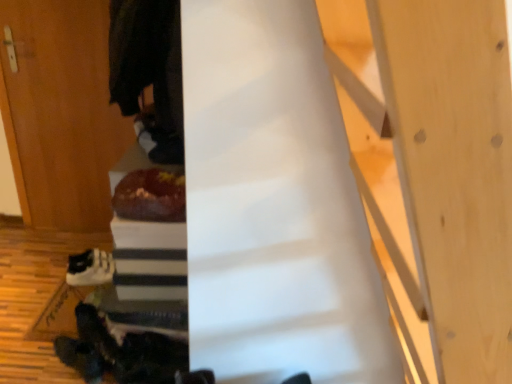
This screenshot has width=512, height=384. What do you see at coordinates (90, 268) in the screenshot?
I see `white matte sneakers at lower left` at bounding box center [90, 268].

Locate an element on the screen. This screenshot has height=384, width=512. wooden door at left is located at coordinates (60, 111).

The height and width of the screenshot is (384, 512). I want to click on dark woolen robe at upper left, so click(147, 58).

You are a GUI agent. You are given a task and a screenshot of the screen. Output one action in this format:
    pyautogui.click(x=<x>, y=<y>)
    Task: Click on the white matte sneakers at lower left
    
    Given the screenshot: What is the action you would take?
    pyautogui.click(x=90, y=268)

Relative to shiny chocolate cake at center, is white matte sneakers at lower left in front or behind?

white matte sneakers at lower left is positioned farther from the viewer than shiny chocolate cake at center.

How many degrees apart are the facing directions of white matte sneakers at lower left and shiny chocolate cake at center?

The angular difference between white matte sneakers at lower left and shiny chocolate cake at center is 165 degrees.

Can you confirm if white matte sneakers at lower left is wider than shiny chocolate cake at center?

In fact, white matte sneakers at lower left might be narrower than shiny chocolate cake at center.

Does wooden door at left touch dark woolen robe at upper left?

No, wooden door at left is not making contact with dark woolen robe at upper left.

Which is in front, wooden door at left or dark woolen robe at upper left?

dark woolen robe at upper left.

In the scene shown: Can you confirm if wooden door at left is shorter than dark woolen robe at upper left?

No.

At what (x,y) coordinates should I click in order to perform the action: click on robe above the wooden door at left (from a real-world perspective). Please return your answer as a coordinate pair (x, y). Looking at the image, I should click on (147, 58).

From the image's perspective, is wooden door at left on top of white matte sneakers at lower left?

→ Yes, from the image's perspective, wooden door at left is over white matte sneakers at lower left.

Which of these two, wooden door at left or white matte sneakers at lower left, is thinner?

Thinner between the two is wooden door at left.

Which is more to the right, wooden door at left or white matte sneakers at lower left?

From the viewer's perspective, white matte sneakers at lower left appears more on the right side.

Considering the relative sizes of dark woolen robe at upper left and wooden door at left in the image provided, is dark woolen robe at upper left smaller than wooden door at left?

No, dark woolen robe at upper left is not smaller than wooden door at left.

The width and height of the screenshot is (512, 384). In order to click on robe lying above the wooden door at left (from the image's perspective) in this screenshot , I will do `click(147, 58)`.

Looking at this image, is dark woolen robe at upper left looking in the opposite direction of wooden door at left?

dark woolen robe at upper left does not have its back to wooden door at left.

From a real-world perspective, is dark woolen robe at upper left on top of wooden door at left?

Correct, in the physical world, dark woolen robe at upper left is higher than wooden door at left.

Considering the points (153, 82) and (69, 255), which point is behind, point (153, 82) or point (69, 255)?

The point (69, 255) is behind.

Based on the photo, from the image's perspective, relative to white matte sneakers at lower left, is dark woolen robe at upper left above or below?

dark woolen robe at upper left is above white matte sneakers at lower left.

In terms of width, does dark woolen robe at upper left look wider or thinner when compared to white matte sneakers at lower left?

In the image, dark woolen robe at upper left appears to be wider than white matte sneakers at lower left.

Where is `footwear on the left of the dark woolen robe at upper left`? footwear on the left of the dark woolen robe at upper left is located at coordinates (90, 268).

From the picture: Can you confirm if white matte sneakers at lower left is thinner than dark woolen robe at upper left?

Correct, the width of white matte sneakers at lower left is less than that of dark woolen robe at upper left.

Is white matte sneakers at lower left far away from dark woolen robe at upper left?

No, white matte sneakers at lower left is in close proximity to dark woolen robe at upper left.

Between point (104, 252) and point (67, 191), which one is positioned in front?

Point (104, 252)

Between white matte sneakers at lower left and wooden door at left, which one has larger width?

Wider between the two is white matte sneakers at lower left.

Between white matte sneakers at lower left and wooden door at left, which one has smaller size?

With smaller size is white matte sneakers at lower left.

Where is `food that is on the right side of white matte sneakers at lower left`? This screenshot has width=512, height=384. food that is on the right side of white matte sneakers at lower left is located at coordinates (151, 196).

I want to click on robe in front of the wooden door at left, so click(x=147, y=58).

Which object lies further to the anchor point dark woolen robe at upper left, wooden door at left or white matte sneakers at lower left?

white matte sneakers at lower left is positioned further to the anchor dark woolen robe at upper left.

Based on their spatial positions, is dark woolen robe at upper left or wooden door at left closer to white matte sneakers at lower left?

Based on the image, wooden door at left appears to be nearer to white matte sneakers at lower left.

Looking at the image, which one is located further to shiny chocolate cake at center, dark woolen robe at upper left or white matte sneakers at lower left?

white matte sneakers at lower left lies further to shiny chocolate cake at center than the other object.

Which object lies nearer to the anchor point white matte sneakers at lower left, wooden door at left or dark woolen robe at upper left?

Among the two, wooden door at left is located nearer to white matte sneakers at lower left.

Which object lies nearer to the anchor point dark woolen robe at upper left, wooden door at left or shiny chocolate cake at center?

shiny chocolate cake at center.

Considering their positions, is dark woolen robe at upper left positioned further to wooden door at left than white matte sneakers at lower left?

dark woolen robe at upper left is positioned further to the anchor wooden door at left.

From the image, which object appears to be farther from wooden door at left, white matte sneakers at lower left or shiny chocolate cake at center?

Based on the image, shiny chocolate cake at center appears to be further to wooden door at left.

Looking at the image, which one is located closer to wooden door at left, white matte sneakers at lower left or dark woolen robe at upper left?

white matte sneakers at lower left.

Where is `food between dark woolen robe at upper left and wooden door at left along the z-axis`? food between dark woolen robe at upper left and wooden door at left along the z-axis is located at coordinates (151, 196).

You are a GUI agent. You are given a task and a screenshot of the screen. Output one action in this format:
    pyautogui.click(x=<x>, y=<y>)
    Task: Click on the food between dark woolen robe at upper left and white matte sneakers at lower left in the up-down direction
    Image resolution: width=512 pixels, height=384 pixels.
    Given the screenshot: What is the action you would take?
    pyautogui.click(x=151, y=196)

Where is `food between wooden door at left and white matte sneakers at lower left from top to bottom`? The height and width of the screenshot is (384, 512). food between wooden door at left and white matte sneakers at lower left from top to bottom is located at coordinates (151, 196).

I want to click on door that lies between dark woolen robe at upper left and white matte sneakers at lower left from top to bottom, so click(60, 111).